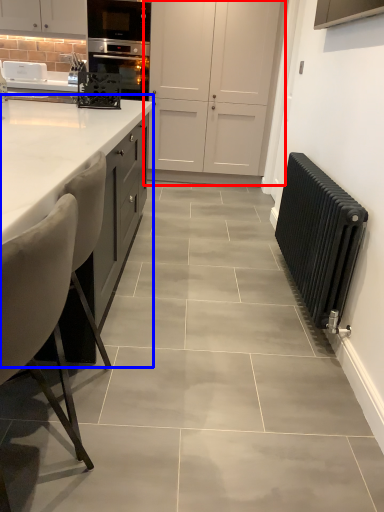
Question: Which point is closer to the camera, cabinetry (highlighted by a red box) or countertop (highlighted by a blue box)?

Choices:
 (A) cabinetry
 (B) countertop

Answer: (B)